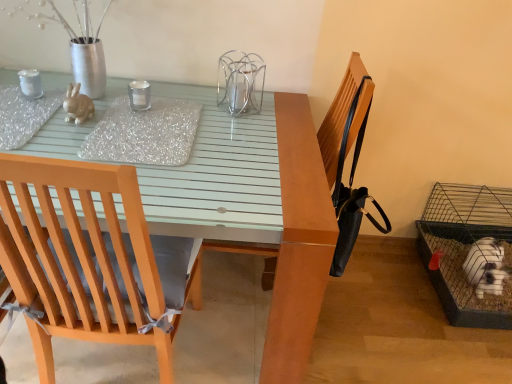
You are a GUI agent. You are given a task and a screenshot of the screen. Output one action in this format:
    pyautogui.click(x=<x>, y=<y>)
    Task: Click on the free space in front of matte ceramic rabbit at upper left
    Image resolution: width=512 pixels, height=384 pixels.
    Given the screenshot: What is the action you would take?
    pyautogui.click(x=67, y=135)